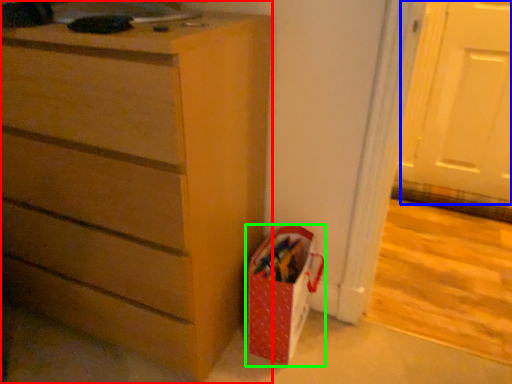
Question: Estimate the real-world distances between objects in this image. Which object is farther from chest of drawers (highlighted by a red box), screen door (highlighted by a blue box) or gift bag (highlighted by a green box)?

Choices:
 (A) screen door
 (B) gift bag

Answer: (A)